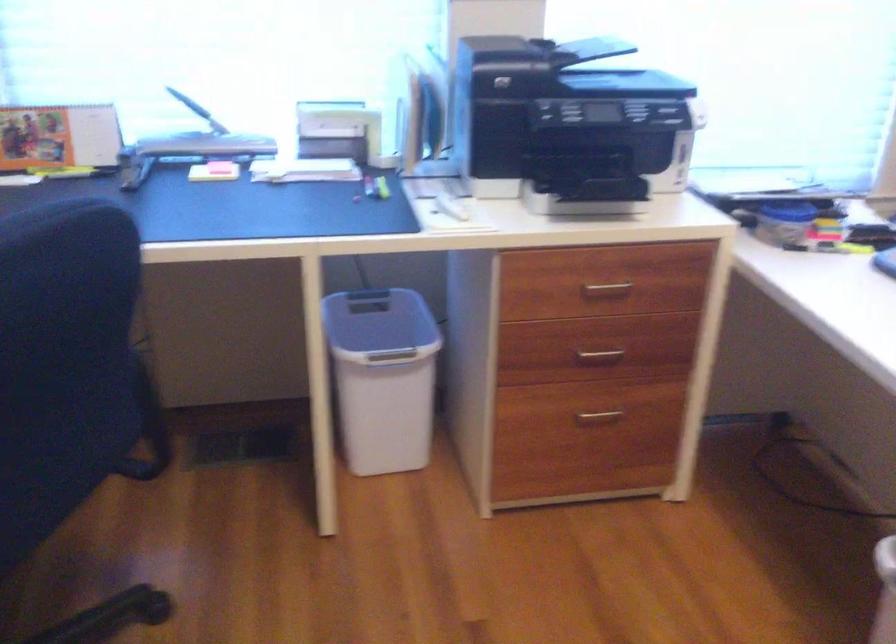
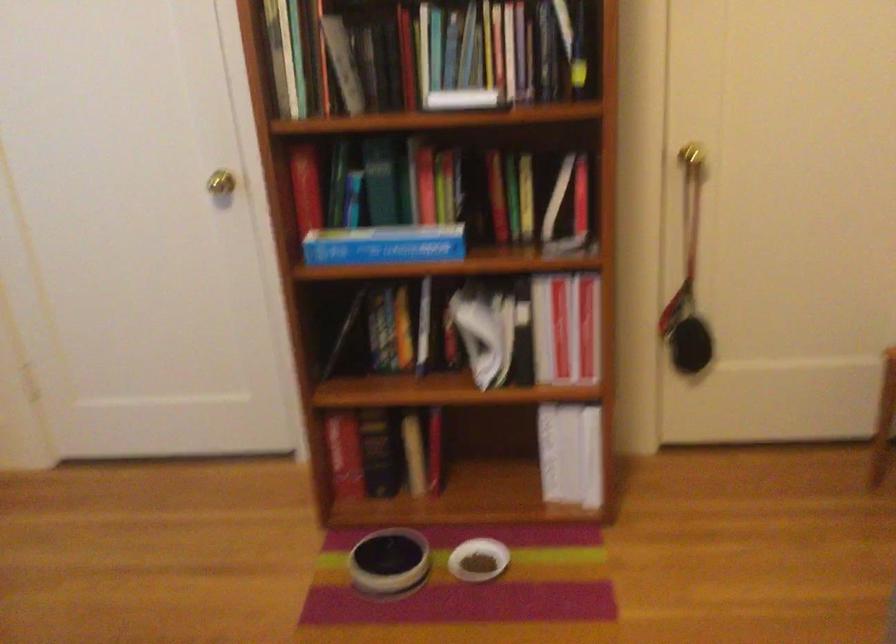
Question: The first image is from the beginning of the video and the second image is from the end. How did the camera likely rotate when shooting the video?

Choices:
 (A) Left
 (B) Right
 (C) Up
 (D) Down

Answer: (B)